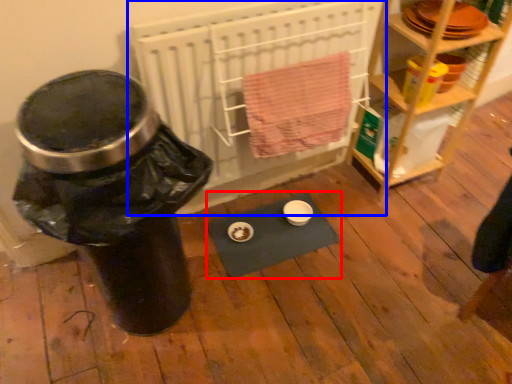
Question: Which point is further to the camera, yoga mat (highlighted by a red box) or wide (highlighted by a blue box)?

Choices:
 (A) yoga mat
 (B) wide

Answer: (A)